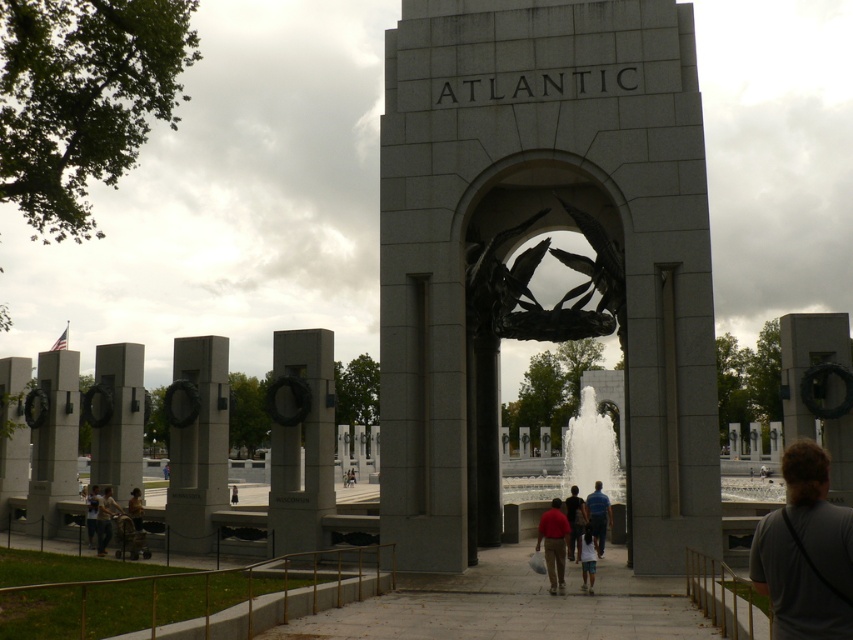
Question: Which of these objects is positioned farthest from the black stone wreath at left?

Choices:
 (A) brown leather jacket at center
 (B) red cotton shirt at center
 (C) smooth gray stone wreath at center

Answer: (B)

Question: Which object appears farthest from the camera in this image?

Choices:
 (A) dark brown leather jacket at lower left
 (B) white marble fountain at center
 (C) brown leather jacket at center

Answer: (B)

Question: Which point is closer to the camera?

Choices:
 (A) light brown leather jacket at lower left
 (B) black stone wreath at left
 (C) brown leather jacket at center
 (D) red shirt at center

Answer: (D)

Question: In this image, where is dark gray concrete wreath at left located relative to wooden cane at lower left?

Choices:
 (A) right
 (B) left

Answer: (B)

Question: Can you confirm if wooden cane at lower left is positioned below red shirt at center?

Choices:
 (A) yes
 (B) no

Answer: (A)

Question: Does gray fabric shirt at lower right lie behind dark brown leather jacket at lower left?

Choices:
 (A) no
 (B) yes

Answer: (A)